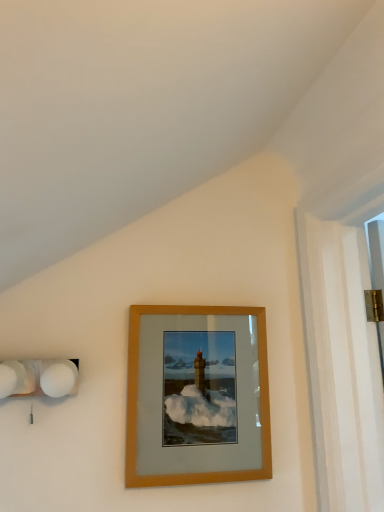
Locate an element on the screen. wooden frame at center is located at coordinates (137, 400).

What do you see at coordinates (137, 400) in the screenshot?
I see `wooden frame at center` at bounding box center [137, 400].

Describe the element at coordinates (39, 378) in the screenshot. Image resolution: width=384 pixels, height=512 pixels. I see `white matte spherical lamps at left` at that location.

This screenshot has width=384, height=512. What are the coordinates of `white matte spherical lamps at left` in the screenshot? It's located at (39, 378).

Where is `wooden frame at center`? The height and width of the screenshot is (512, 384). wooden frame at center is located at coordinates (137, 400).

Is wooden frame at center to the left or to the right of white matte spherical lamps at left in the image?

wooden frame at center is to the right of white matte spherical lamps at left.

Does wooden frame at center lie in front of white matte spherical lamps at left?

No, it is not.

Considering the points (146, 486) and (16, 372), which point is behind, point (146, 486) or point (16, 372)?

The point (146, 486) is farther from the camera.

From the image's perspective, which is below, wooden frame at center or white matte spherical lamps at left?

From the image's view, wooden frame at center is below.

In the scene shown: From a real-world perspective, is wooden frame at center under white matte spherical lamps at left?

Indeed, from a real-world perspective, wooden frame at center is positioned beneath white matte spherical lamps at left.

Considering the sizes of objects wooden frame at center and white matte spherical lamps at left in the image provided, who is thinner, wooden frame at center or white matte spherical lamps at left?

Thinner between the two is wooden frame at center.

From the picture: Between wooden frame at center and white matte spherical lamps at left, which one has more height?

wooden frame at center is taller.

Does wooden frame at center have a smaller size compared to white matte spherical lamps at left?

Actually, wooden frame at center might be larger than white matte spherical lamps at left.

Choose the correct answer: Is wooden frame at center inside white matte spherical lamps at left or outside it?

wooden frame at center is not inside white matte spherical lamps at left, it's outside.

Is wooden frame at center positioned far away from white matte spherical lamps at left?

No.

Looking at this image, is white matte spherical lamps at left at the back of wooden frame at center?

No, wooden frame at center is not facing the opposite direction of white matte spherical lamps at left.

You are a GUI agent. You are given a task and a screenshot of the screen. Output one action in this format:
    pyautogui.click(x=<x>, y=<y>)
    Task: Click on the picture frame lying on the right of white matte spherical lamps at left
    The width and height of the screenshot is (384, 512).
    Given the screenshot: What is the action you would take?
    pyautogui.click(x=137, y=400)

Which is more to the left, white matte spherical lamps at left or wooden frame at center?

From the viewer's perspective, white matte spherical lamps at left appears more on the left side.

Which object is closer to the camera, white matte spherical lamps at left or wooden frame at center?

white matte spherical lamps at left is more forward.

Considering the positions of points (3, 396) and (134, 434), is point (3, 396) farther from camera compared to point (134, 434)?

That is False.

From the image's perspective, would you say white matte spherical lamps at left is positioned over wooden frame at center?

Indeed, from the image's perspective, white matte spherical lamps at left is shown above wooden frame at center.

From a real-world perspective, between white matte spherical lamps at left and wooden frame at center, who is vertically higher?

white matte spherical lamps at left is physically above.

Which of these two, white matte spherical lamps at left or wooden frame at center, is thinner?

With smaller width is wooden frame at center.

From their relative heights in the image, would you say white matte spherical lamps at left is taller or shorter than wooden frame at center?

Considering their sizes, white matte spherical lamps at left has less height than wooden frame at center.

Can you confirm if white matte spherical lamps at left is smaller than wooden frame at center?

Yes.

In the scene shown: Is white matte spherical lamps at left completely or partially outside of wooden frame at center?

Yes, white matte spherical lamps at left is outside of wooden frame at center.

Is white matte spherical lamps at left not close to wooden frame at center?

That's not correct — white matte spherical lamps at left is a little close to wooden frame at center.

Is white matte spherical lamps at left aimed at wooden frame at center?

No, white matte spherical lamps at left does not turn towards wooden frame at center.

Can you tell me how much white matte spherical lamps at left and wooden frame at center differ in facing direction?

They differ by 0.0249 degrees in their facing directions.

In the image, there is a wooden frame at center. Identify the location of lamp above it (from the image's perspective). Image resolution: width=384 pixels, height=512 pixels. (39, 378).

Image resolution: width=384 pixels, height=512 pixels. In the image, there is a wooden frame at center. Find the location of `lamp above it (from the image's perspective)`. lamp above it (from the image's perspective) is located at coordinates (39, 378).

This screenshot has width=384, height=512. I want to click on picture frame below the white matte spherical lamps at left (from the image's perspective), so click(137, 400).